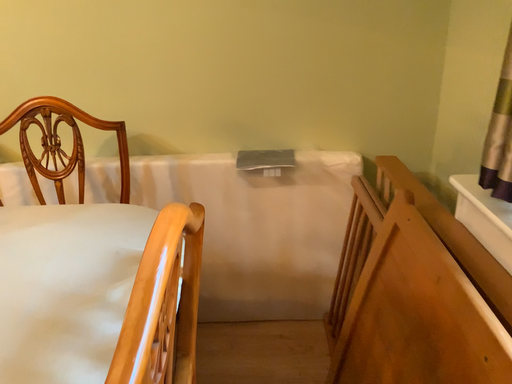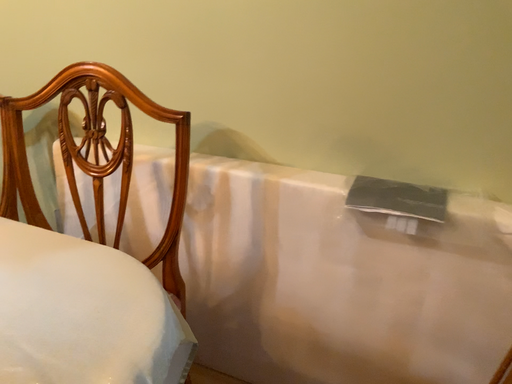
Question: Which way did the camera rotate in the video?

Choices:
 (A) rotated left
 (B) rotated right

Answer: (A)